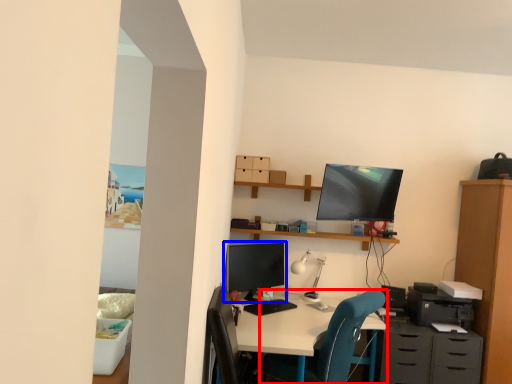
Question: Which object is further to the camera taking this photo, chair (highlighted by a red box) or computer monitor (highlighted by a blue box)?

Choices:
 (A) chair
 (B) computer monitor

Answer: (B)